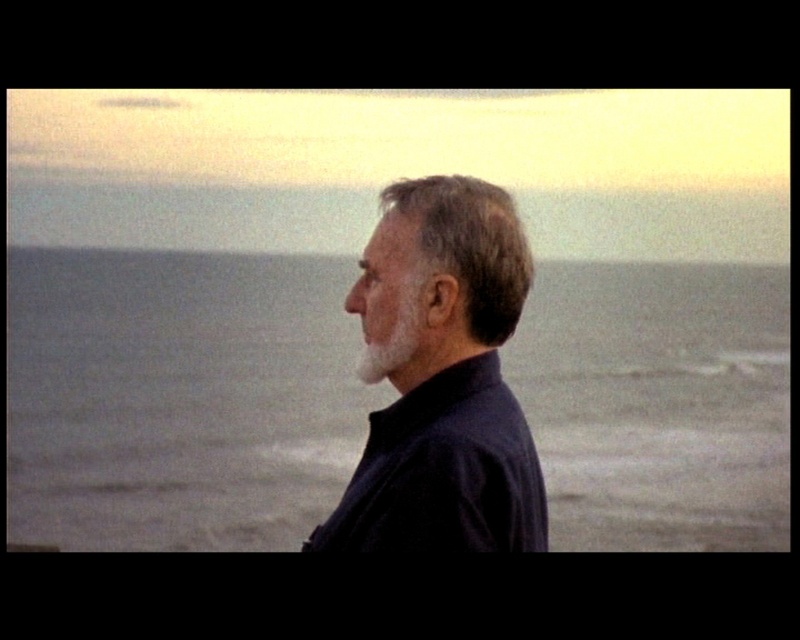
You are a photographer trying to capture the man in the scene. To ensure the man is fully visible in your photo, which object should you focus on first, the gray matte water at center or the dark brown textured hair at center?

The dark brown textured hair at center should be focused on first since it is above the gray matte water at center, making it closer to the camera and easier to capture clearly.

You are a photographer standing at the edge of the sea, and you want to take a photo of the man with dark brown textured hair at center so that he is framed perfectly between the horizon and the waves. The camera you are using has a focal length of 50mm. Given that the recommended distance between the subject and the photographer for this focal length is between 3 to 5 meters, can you safely take the photo without moving closer or farther away?

The man with dark brown textured hair at center is 6.68 meters away, which exceeds the recommended 3 to 5 meters distance for a 50mm focal length. To frame him perfectly between the horizon and the waves, you should move closer to reduce the distance to within the recommended range.

You are a photographer trying to capture the man in the scene. Since the gray matte water at center and the white matte beard at center are both in the frame, which one takes up more space in the photo?

The gray matte water at center takes up more space in the photo because it is bigger than the white matte beard at center.